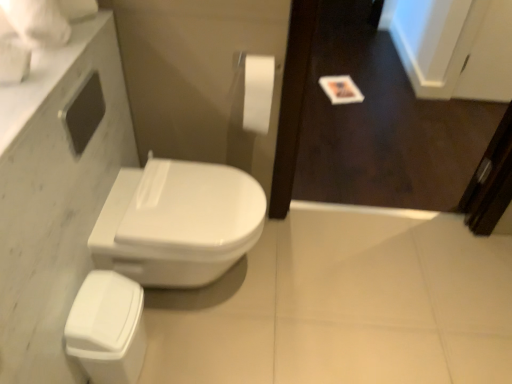
Question: Is wooden screen door at upper right positioned behind white matte toilet paper at upper center?

Choices:
 (A) no
 (B) yes

Answer: (A)

Question: Is wooden screen door at upper right oriented away from white matte toilet paper at upper center?

Choices:
 (A) yes
 (B) no

Answer: (B)

Question: From the image's perspective, is wooden screen door at upper right on white matte toilet paper at upper center?

Choices:
 (A) yes
 (B) no

Answer: (B)

Question: From the image's perspective, does wooden screen door at upper right appear lower than white matte toilet paper at upper center?

Choices:
 (A) yes
 (B) no

Answer: (A)

Question: Is wooden screen door at upper right positioned in front of white matte toilet paper at upper center?

Choices:
 (A) no
 (B) yes

Answer: (B)

Question: From a real-world perspective, is wooden screen door at upper right below white matte toilet paper at upper center?

Choices:
 (A) no
 (B) yes

Answer: (B)

Question: Is white glossy bidet at center surrounding white marble countertop at upper left?

Choices:
 (A) yes
 (B) no

Answer: (B)

Question: Would you say white glossy bidet at center is a long distance from white marble countertop at upper left?

Choices:
 (A) no
 (B) yes

Answer: (A)

Question: Is white glossy bidet at center looking in the opposite direction of white marble countertop at upper left?

Choices:
 (A) yes
 (B) no

Answer: (B)

Question: From the image's perspective, does white glossy bidet at center appear lower than white marble countertop at upper left?

Choices:
 (A) yes
 (B) no

Answer: (A)

Question: Considering the relative sizes of white glossy bidet at center and white marble countertop at upper left in the image provided, is white glossy bidet at center smaller than white marble countertop at upper left?

Choices:
 (A) yes
 (B) no

Answer: (B)

Question: Is white glossy bidet at center wider than white marble countertop at upper left?

Choices:
 (A) yes
 (B) no

Answer: (A)

Question: Is white marble countertop at upper left aimed at wooden screen door at upper right?

Choices:
 (A) no
 (B) yes

Answer: (A)